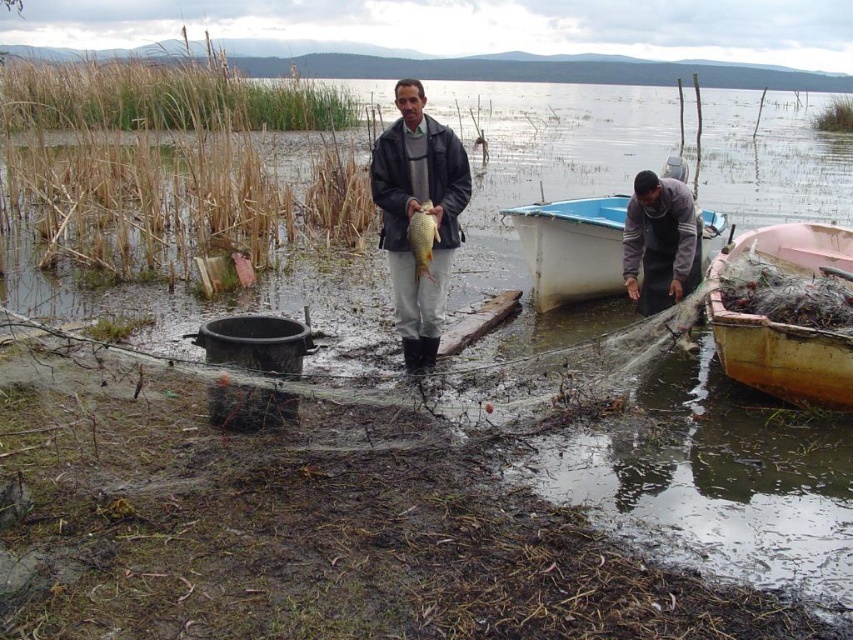
You are a photographer trying to capture a clear shot of the matte black jacket at center and the white plastic boat at lower center. Which object should you focus on first if you want to ensure both are in focus without adjusting your camera settings?

The matte black jacket at center is in front of the white plastic boat at lower center. To ensure both are in focus, you should focus on the matte black jacket at center first since it is closer to the camera.

You are standing on the muddy ground near the lake and want to take a photo of the white plastic boat at lower center using your camera. If the camera has a maximum focus range of 25 feet, will you be able to take a clear photo of the boat?

The white plastic boat at lower center and camera are 26.84 feet apart from each other, which exceeds the camera maximum focus range of 25 feet. Therefore, you won not be able to take a clear photo of the boat.